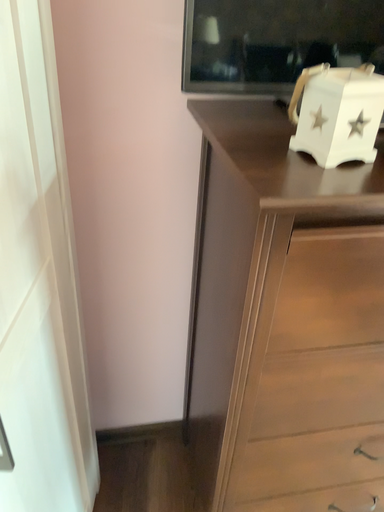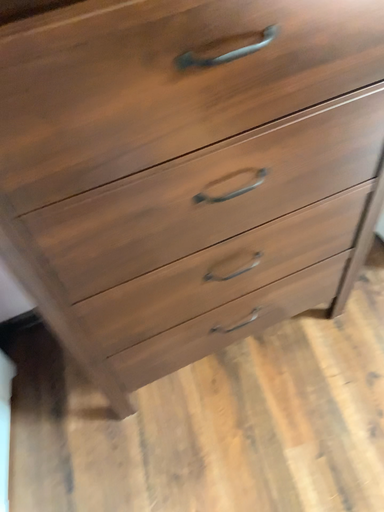
Question: Which way did the camera rotate in the video?

Choices:
 (A) rotated downward
 (B) rotated upward

Answer: (A)